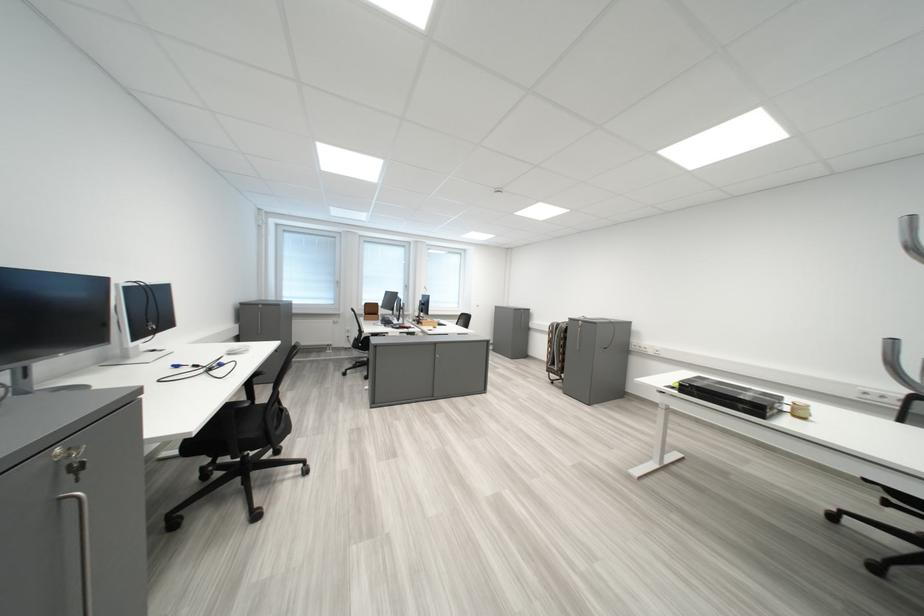
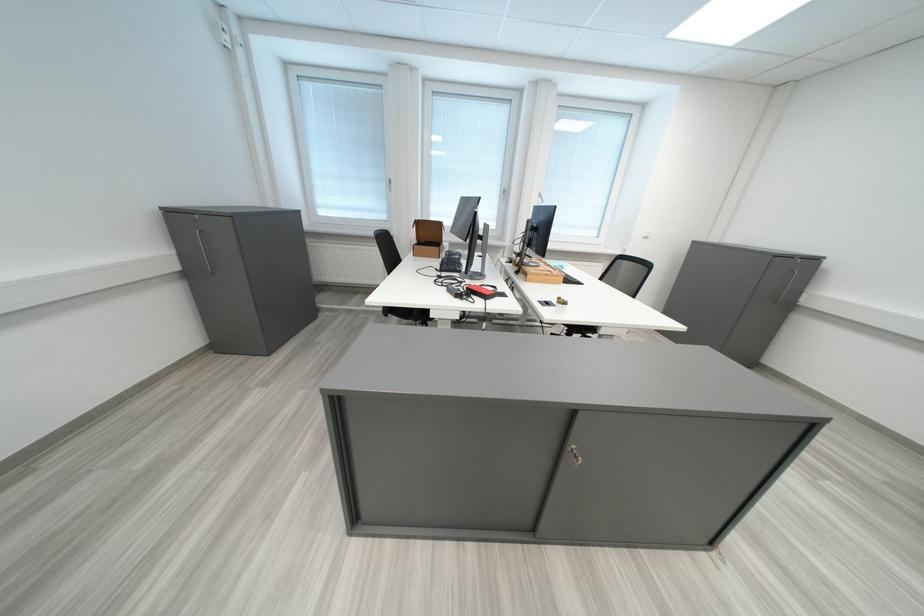
Find the pixel in the second image that matches (x=394, y=320) in the first image.

(456, 256)